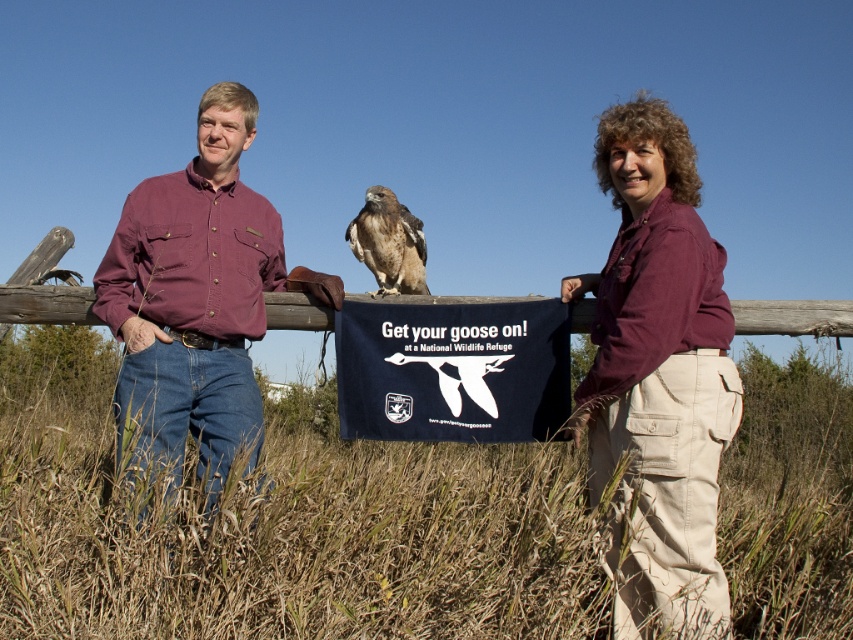
Question: Based on their relative distances, which object is nearer to the matte purple shirt at center?

Choices:
 (A) maroon shirt at center
 (B) maroon cotton shirt at center
 (C) brown feathered falcon at center
 (D) navy blue fabric sign at center

Answer: (A)

Question: Does maroon shirt at center appear under brown feathered falcon at center?

Choices:
 (A) no
 (B) yes

Answer: (B)

Question: Which of these objects is positioned farthest from the maroon cotton shirt at center?

Choices:
 (A) brown feathered falcon at center
 (B) maroon shirt at center

Answer: (B)

Question: Can you confirm if maroon shirt at center is positioned above matte purple shirt at center?

Choices:
 (A) no
 (B) yes

Answer: (B)

Question: Estimate the real-world distances between objects in this image. Which object is closer to the navy blue fabric sign at center?

Choices:
 (A) maroon shirt at center
 (B) brown feathered falcon at center
 (C) maroon cotton shirt at center

Answer: (A)

Question: Is maroon cotton shirt at center bigger than brown feathered falcon at center?

Choices:
 (A) no
 (B) yes

Answer: (B)